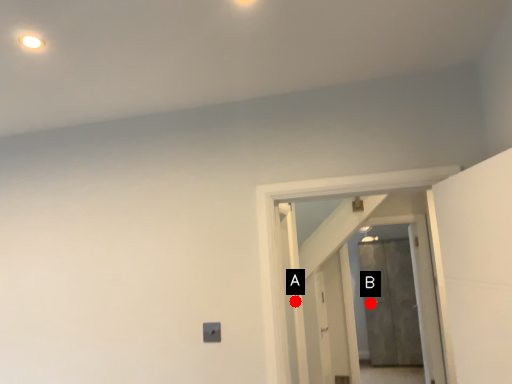
Question: Two points are circled on the image, labeled by A and B beside each circle. Which point is farther from the camera taking this photo?

Choices:
 (A) A is further
 (B) B is further

Answer: (B)